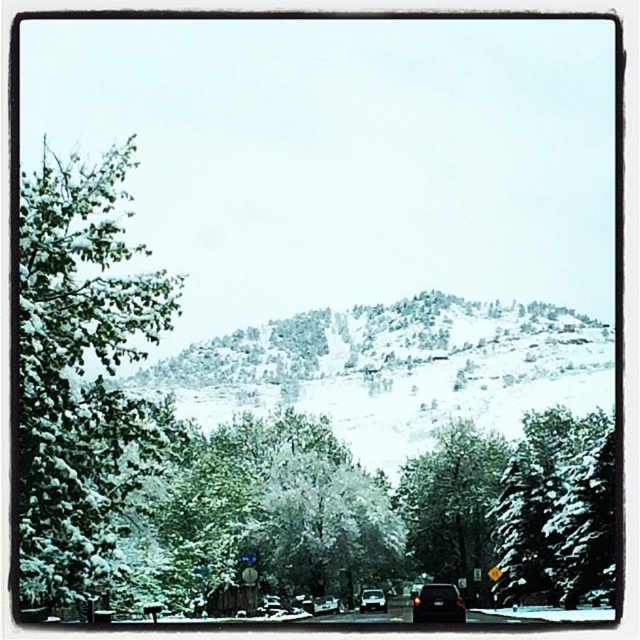
Question: Is green leafy tree at left below snow-covered tree at center?

Choices:
 (A) no
 (B) yes

Answer: (A)

Question: Which object is farther from the camera taking this photo?

Choices:
 (A) snow-covered tree at center
 (B) black matte van at center
 (C) green leafy tree at left

Answer: (A)

Question: Does snow-covered evergreen at right have a larger size compared to shiny black car at center?

Choices:
 (A) yes
 (B) no

Answer: (A)

Question: Can you confirm if shiny black car at center is positioned to the right of shiny silver sedan at center?

Choices:
 (A) yes
 (B) no

Answer: (B)

Question: Which of these objects is positioned closest to the black matte van at center?

Choices:
 (A) shiny black car at center
 (B) snow-covered tree at center
 (C) shiny silver sedan at center
 (D) snow-covered evergreen at right

Answer: (C)

Question: Considering the real-world distances, which object is closest to the snow-covered tree at center?

Choices:
 (A) shiny black car at center
 (B) black matte van at center
 (C) snow-covered evergreen at right
 (D) green leafy tree at left

Answer: (C)